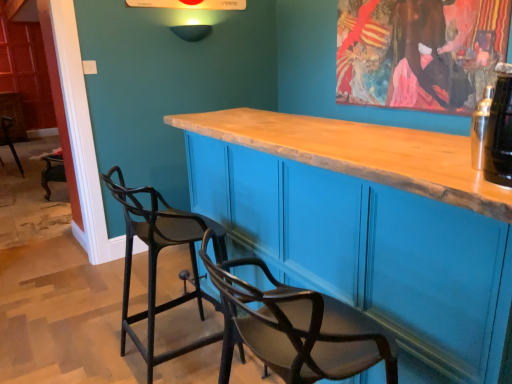
I want to click on free spot behind black glass bottle at upper right, so click(x=447, y=158).